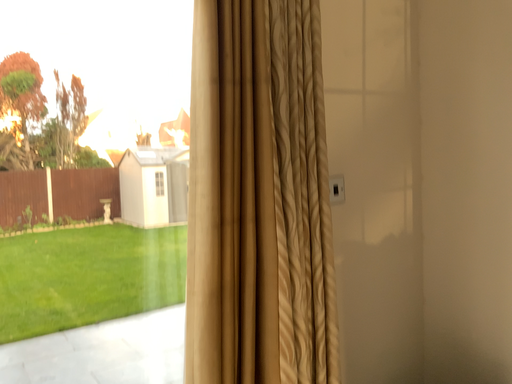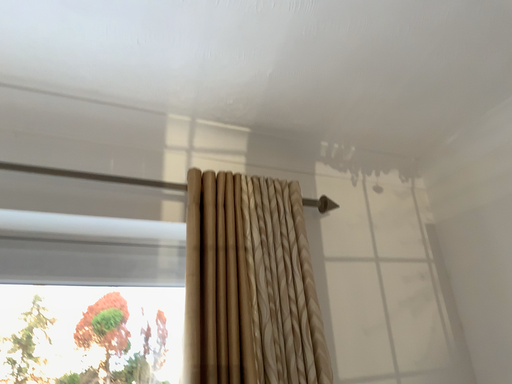
Question: Which way did the camera rotate in the video?

Choices:
 (A) rotated downward
 (B) rotated upward

Answer: (B)